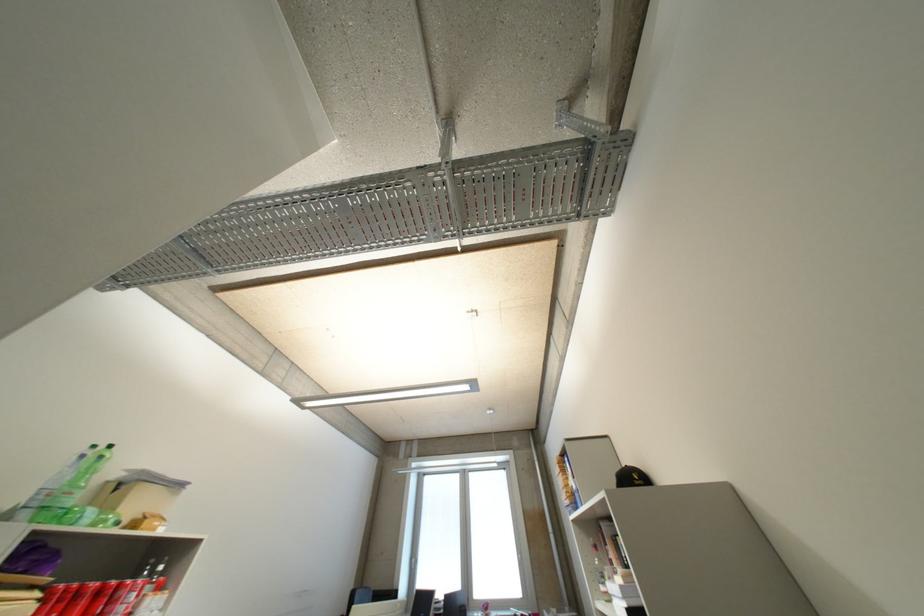
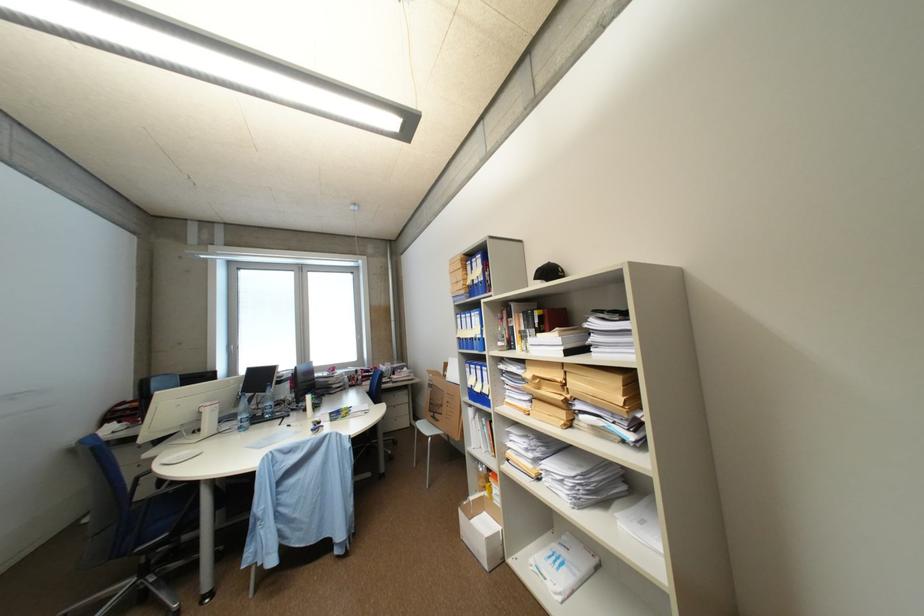
The first image is from the beginning of the video and the second image is from the end. How did the camera likely rotate when shooting the video?

The camera's rotation is toward right-down.